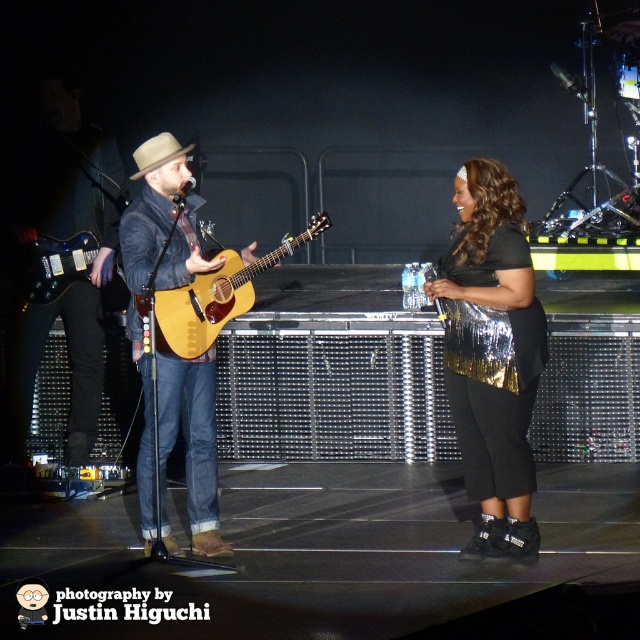
Which of these two, black sequined purse at center or matte brown guitar at left, stands shorter?

black sequined purse at center is shorter.

Which is behind, point (502, 202) or point (26, 193)?

Positioned behind is point (26, 193).

What do you see at coordinates (492, 355) in the screenshot?
I see `black sequined purse at center` at bounding box center [492, 355].

What are the coordinates of `black sequined purse at center` in the screenshot? It's located at (492, 355).

Which is more to the left, black sequined purse at center or light brown acoustic guitar at center?

Positioned to the left is light brown acoustic guitar at center.

Does black sequined purse at center appear over light brown acoustic guitar at center?

Incorrect, black sequined purse at center is not positioned above light brown acoustic guitar at center.

At what (x,y) coordinates should I click in order to perform the action: click on black sequined purse at center. Please return your answer as a coordinate pair (x, y). Looking at the image, I should click on (492, 355).

Who is positioned more to the right, black sequined purse at center or denim jacket at center?

From the viewer's perspective, black sequined purse at center appears more on the right side.

Can you confirm if black sequined purse at center is positioned below denim jacket at center?

Indeed, black sequined purse at center is positioned under denim jacket at center.

Locate an element on the screen. black sequined purse at center is located at coordinates (492, 355).